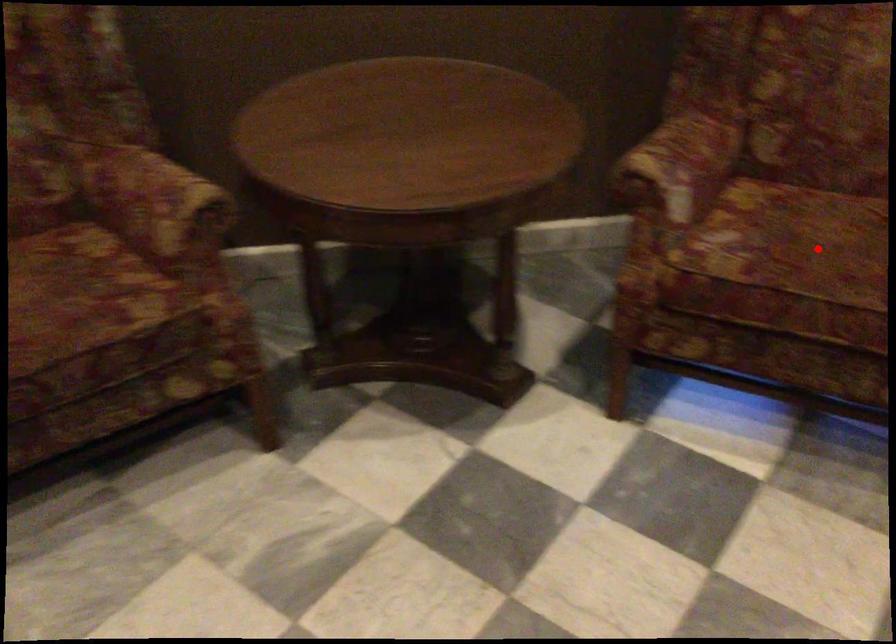
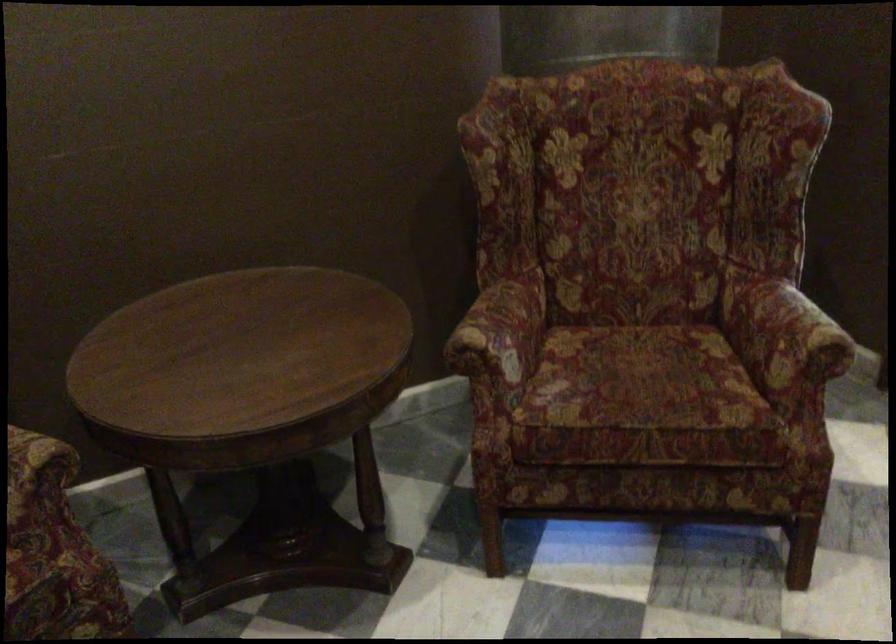
Question: I am providing you with two images of the same scene from different viewpoints. In image1, a red point is highlighted. Considering the same 3D point in image2, which of the following is correct?

Choices:
 (A) It is closer
 (B) It is farther

Answer: (B)